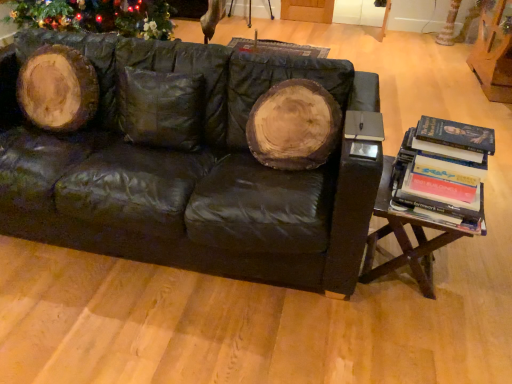
The width and height of the screenshot is (512, 384). In order to click on free space behind white textured tree trunk at upper right in this screenshot , I will do `click(436, 42)`.